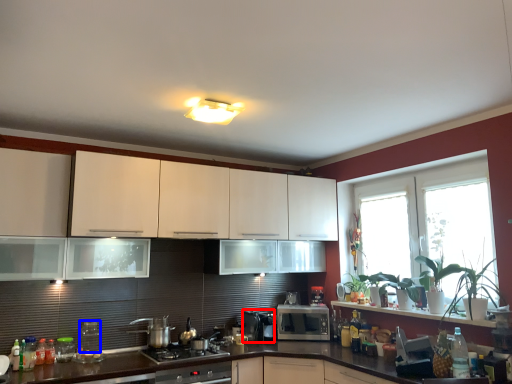
Question: Which of the following is the farthest to the observer, appliance (highlighted by a red box) or appliance (highlighted by a blue box)?

Choices:
 (A) appliance
 (B) appliance

Answer: (A)